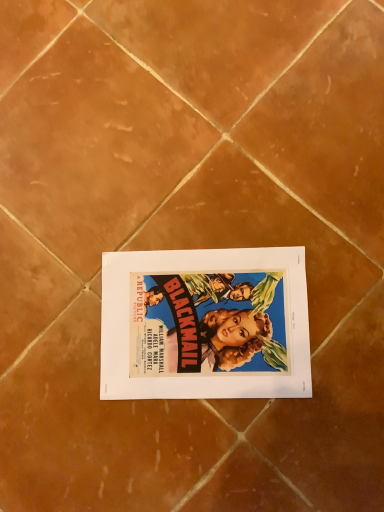
Where is `vacant area on top of vibrant paper poster at center (from a real-world perspective)`? The height and width of the screenshot is (512, 384). vacant area on top of vibrant paper poster at center (from a real-world perspective) is located at coordinates (192, 323).